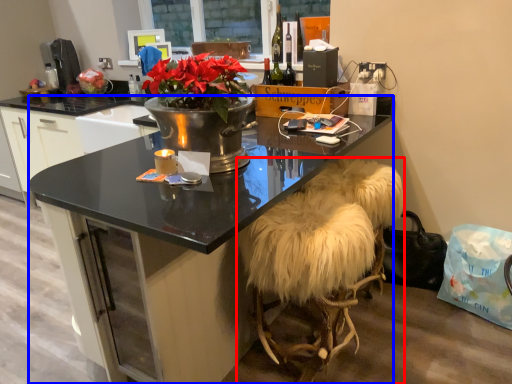
Question: Which of the following is the farthest to the observer, stool (highlighted by a red box) or desk (highlighted by a blue box)?

Choices:
 (A) stool
 (B) desk

Answer: (A)